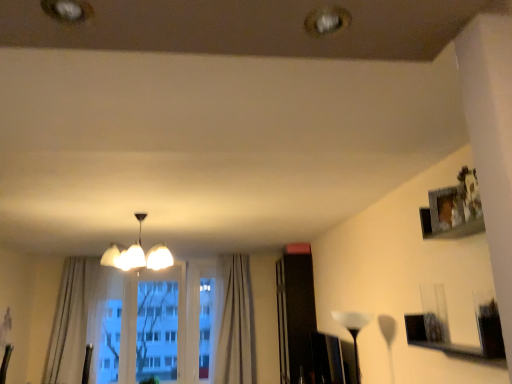
Question: Considering the relative positions of transparent glass window at center and white translucent lampshade at center, positioned as the 2th lamp in left-to-right order, in the image provided, is transparent glass window at center to the right of white translucent lampshade at center, positioned as the 2th lamp in left-to-right order, from the viewer's perspective?

Choices:
 (A) no
 (B) yes

Answer: (A)

Question: Is transparent glass window at center looking in the opposite direction of white translucent lampshade at center, placed as the 1th lamp when sorted from bottom to top?

Choices:
 (A) yes
 (B) no

Answer: (B)

Question: Can you confirm if transparent glass window at center is bigger than white translucent lampshade at center, placed as the 1th lamp when sorted from bottom to top?

Choices:
 (A) no
 (B) yes

Answer: (B)

Question: Considering the relative sizes of transparent glass window at center and white translucent lampshade at center, which is the 1th lamp from right to left, in the image provided, is transparent glass window at center taller than white translucent lampshade at center, which is the 1th lamp from right to left,?

Choices:
 (A) yes
 (B) no

Answer: (A)

Question: From the image's perspective, is transparent glass window at center on top of white translucent lampshade at center, which is the 1th lamp from right to left?

Choices:
 (A) yes
 (B) no

Answer: (B)

Question: Would you say light beige textured curtain at center, the 1th curtain viewed from the right, is to the left or to the right of transparent glass window at center in the picture?

Choices:
 (A) right
 (B) left

Answer: (A)

Question: Relative to transparent glass window at center, is light beige textured curtain at center, the 1th curtain viewed from the right, in front or behind?

Choices:
 (A) front
 (B) behind

Answer: (A)

Question: From the image's perspective, is light beige textured curtain at center, which appears as the second curtain when viewed from the left, positioned above or below transparent glass window at center?

Choices:
 (A) above
 (B) below

Answer: (A)

Question: Is point (250, 311) positioned closer to the camera than point (92, 331)?

Choices:
 (A) farther
 (B) closer

Answer: (B)

Question: From the image's perspective, is white glossy chandelier at center, placed as the second lamp when sorted from right to left, above or below white translucent lampshade at center, which is the 1th lamp from right to left?

Choices:
 (A) below
 (B) above

Answer: (B)

Question: Is white glossy chandelier at center, the 1th lamp positioned from the left, wider or thinner than white translucent lampshade at center, the 2th lamp from the top?

Choices:
 (A) wide
 (B) thin

Answer: (A)

Question: From a real-world perspective, is white glossy chandelier at center, the first lamp positioned from the top, physically located above or below white translucent lampshade at center, the 2th lamp from the top?

Choices:
 (A) below
 (B) above

Answer: (B)

Question: Is white glossy chandelier at center, the 1th lamp positioned from the left, to the left or to the right of white translucent lampshade at center, positioned as the 2th lamp in left-to-right order, in the image?

Choices:
 (A) right
 (B) left

Answer: (B)

Question: From a real-world perspective, is white translucent lampshade at center, positioned as the 2th lamp in left-to-right order, physically located above or below light beige fabric curtain at left, acting as the second curtain starting from the right?

Choices:
 (A) above
 (B) below

Answer: (B)

Question: Looking at their shapes, would you say white translucent lampshade at center, the 2th lamp from the top, is wider or thinner than light beige fabric curtain at left, the first curtain from the left?

Choices:
 (A) thin
 (B) wide

Answer: (A)